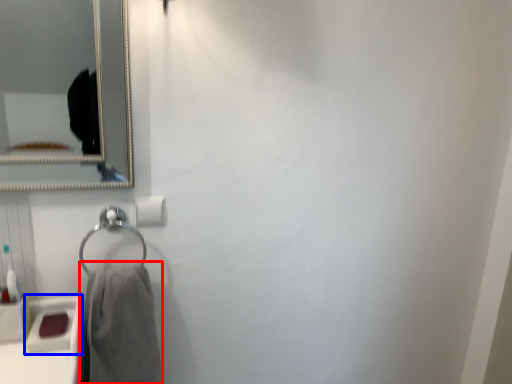
Question: Among these objects, which one is nearest to the camera, bath towel (highlighted by a red box) or sink (highlighted by a blue box)?

Choices:
 (A) bath towel
 (B) sink

Answer: (A)